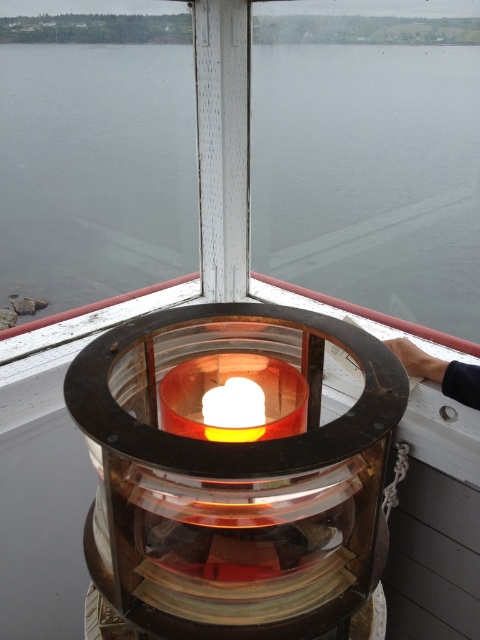
You are a lighthouse keeper checking the lighthouse lantern. You see the transparent glass water at center and the translucent glass candle at center. Which object is positioned higher in the lantern?

The transparent glass water at center is above the translucent glass candle at center, so the transparent glass water at center is positioned higher in the lantern.

You are inside the lighthouse lantern room and want to touch both the point at coordinates point (68, 157) and point (419, 369). Which point should you reach for first to touch the one closer to you?

You should reach for point (68, 157) first because it is closer to you than point (419, 369).